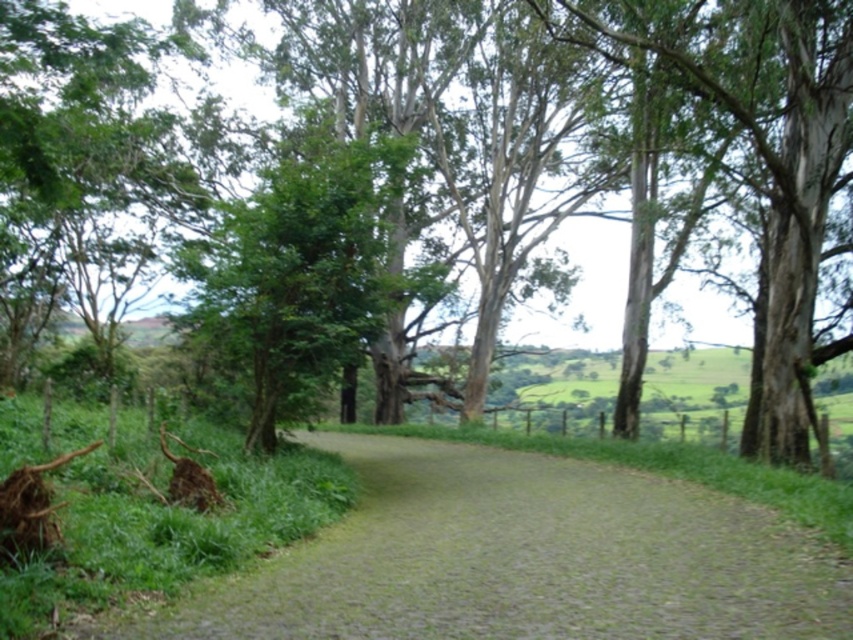
Question: Can you confirm if dirt/gravel path at center is positioned to the left of green leafy tree at center?

Choices:
 (A) no
 (B) yes

Answer: (A)

Question: Is dirt/gravel path at center further to the viewer compared to green leafy tree at center?

Choices:
 (A) no
 (B) yes

Answer: (A)

Question: Which point is farther from the camera taking this photo?

Choices:
 (A) (419, 442)
 (B) (642, 35)

Answer: (A)

Question: Does dirt/gravel path at center appear on the left side of green leafy tree at center?

Choices:
 (A) yes
 (B) no

Answer: (B)